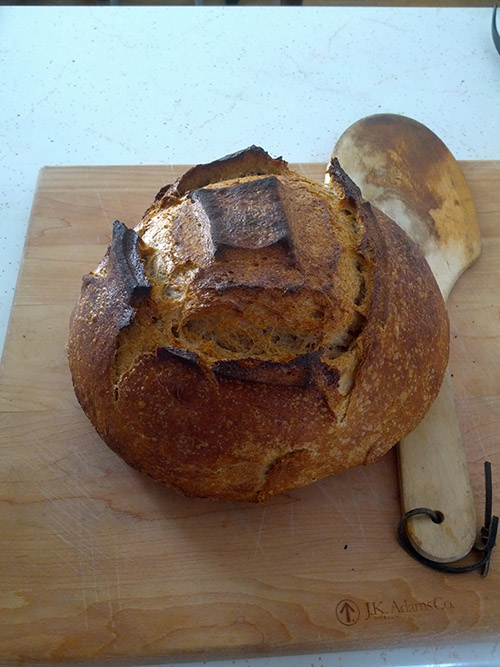
You are a GUI agent. You are given a task and a screenshot of the screen. Output one action in this format:
    pyautogui.click(x=<x>, y=<y>)
    Task: Click on the counter top
    The image size is (500, 667).
    Given the screenshot: What is the action you would take?
    pyautogui.click(x=220, y=93)